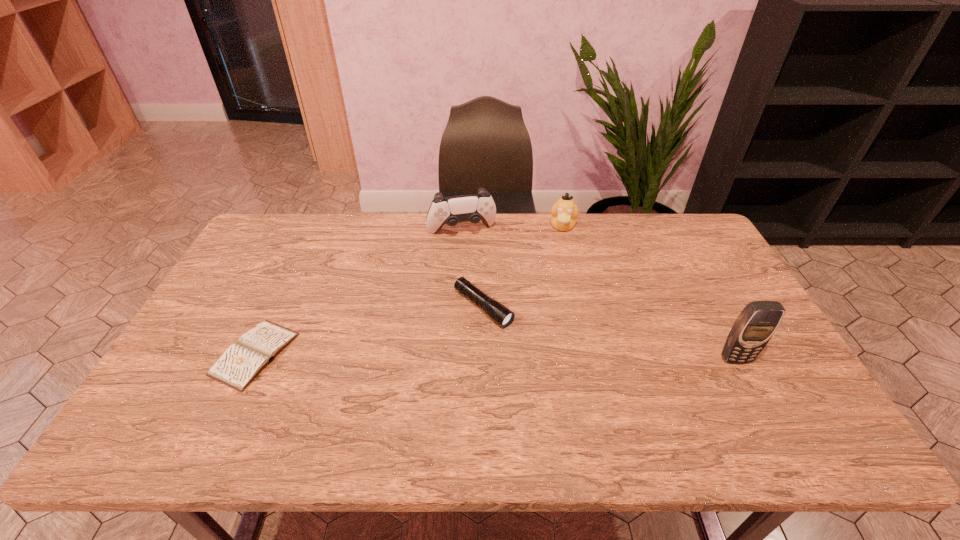
At what (x,y) coordinates should I click in order to perform the action: click on vacant area that lies between the leftmost object and the control. Please return your answer as a coordinate pair (x, y). Image resolution: width=960 pixels, height=540 pixels. Looking at the image, I should click on (358, 293).

This screenshot has width=960, height=540. I want to click on free space that is in between the diary and the tallest object, so click(x=495, y=356).

Identify the location of vacant space that is in between the duckling and the flashlight. This screenshot has height=540, width=960. (523, 267).

Locate an element on the screen. This screenshot has width=960, height=540. vacant space that's between the tallest object and the leftmost object is located at coordinates (495, 356).

Image resolution: width=960 pixels, height=540 pixels. What are the coordinates of `free spot between the cellular telephone and the fourth object from left to right` in the screenshot? It's located at (649, 293).

The image size is (960, 540). I want to click on free space between the cellular telephone and the second shortest object, so click(x=610, y=333).

You are a GUI agent. You are given a task and a screenshot of the screen. Output one action in this format:
    pyautogui.click(x=<x>, y=<y>)
    Task: Click on the free space between the leftmost object and the flashlight
    Image resolution: width=960 pixels, height=540 pixels.
    Given the screenshot: What is the action you would take?
    pyautogui.click(x=370, y=330)

This screenshot has height=540, width=960. In order to click on vacant space in between the flashlight and the control in this screenshot , I will do coord(472,269).

Where is `vacant area that lies between the control and the rightmost object`? vacant area that lies between the control and the rightmost object is located at coordinates (598, 295).

This screenshot has width=960, height=540. What are the coordinates of `unoccupied position between the third shortest object and the tallest object` in the screenshot? It's located at (649, 293).